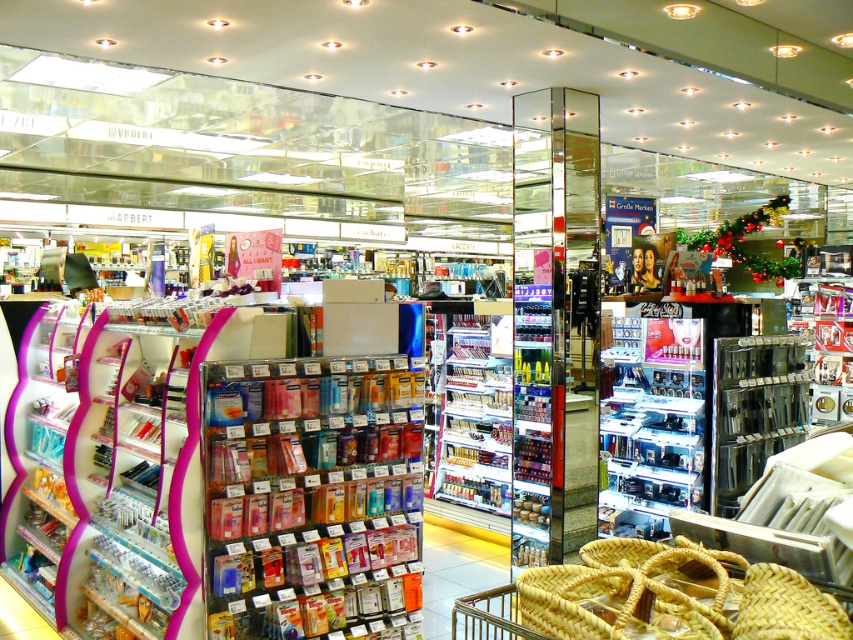
Is clear plastic packaging at center taller than metallic silver lipsticks at center?

Incorrect, clear plastic packaging at center's height is not larger of metallic silver lipsticks at center's.

Is clear plastic packaging at center to the right of metallic silver lipsticks at center from the viewer's perspective?

Incorrect, clear plastic packaging at center is not on the right side of metallic silver lipsticks at center.

Who is more distant from viewer, (315, 365) or (682, 401)?

Point (682, 401)

The height and width of the screenshot is (640, 853). Identify the location of clear plastic packaging at center. (310, 493).

Based on the photo, can you confirm if clear plastic packaging at center is positioned below shiny plastic lipstick at center?

Correct, clear plastic packaging at center is located below shiny plastic lipstick at center.

Who is more distant from viewer, [225,436] or [480,458]?

The point [480,458] is behind.

Is point (323, 579) positioned behind point (434, 308)?

No, (323, 579) is in front of (434, 308).

This screenshot has width=853, height=640. Find the location of `clear plastic packaging at center`. clear plastic packaging at center is located at coordinates click(x=310, y=493).

Can you confirm if metallic silver lipsticks at center is positioned to the left of shiny plastic lipstick at center?

No, metallic silver lipsticks at center is not to the left of shiny plastic lipstick at center.

Between point (647, 388) and point (463, 436), which one is positioned in front?

Positioned in front is point (647, 388).

Find the location of a particular element. This screenshot has width=853, height=640. metallic silver lipsticks at center is located at coordinates (654, 422).